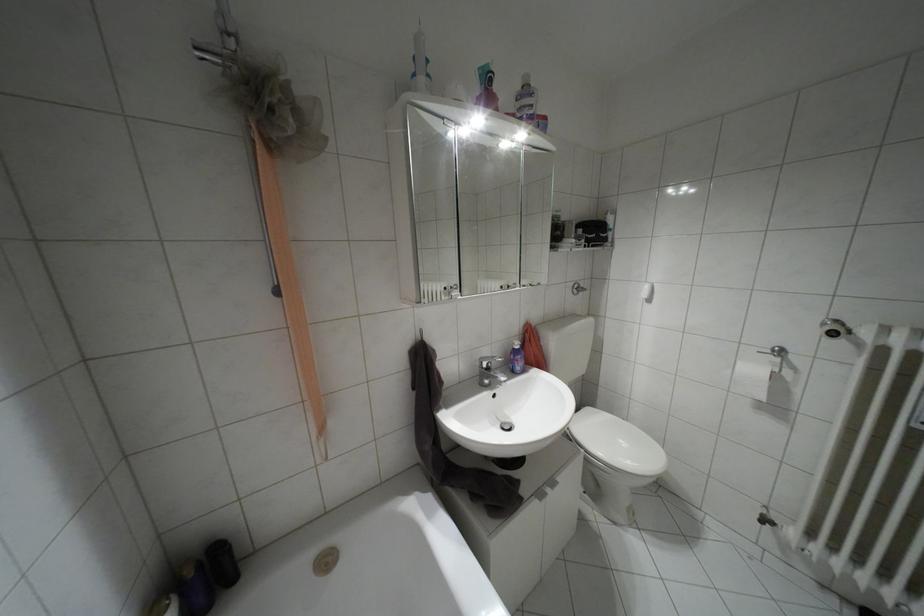
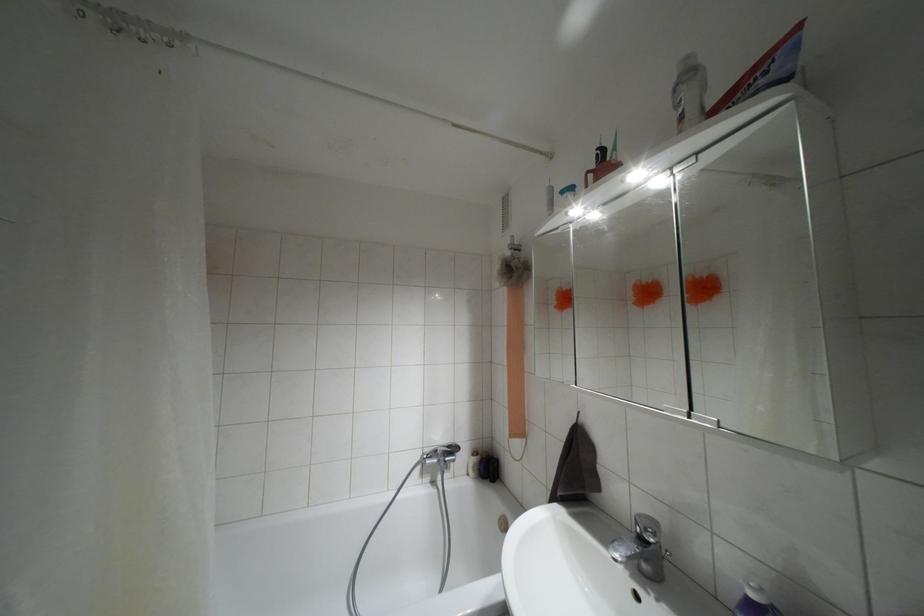
Where in the second image is the point corresponding to [488,368] from the first image?

(641, 538)